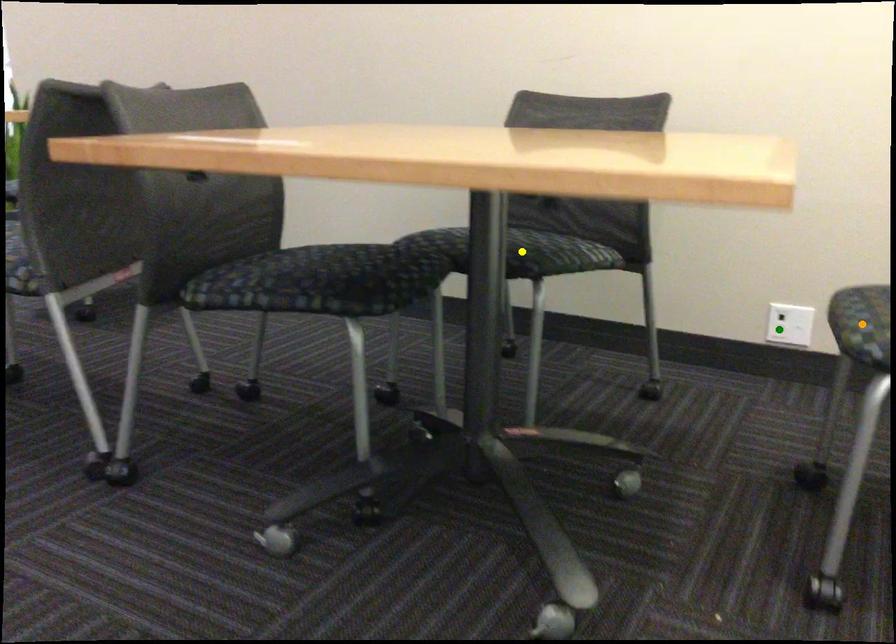
Order these from farthest to nearest:
1. orange point
2. yellow point
3. green point

green point, yellow point, orange point